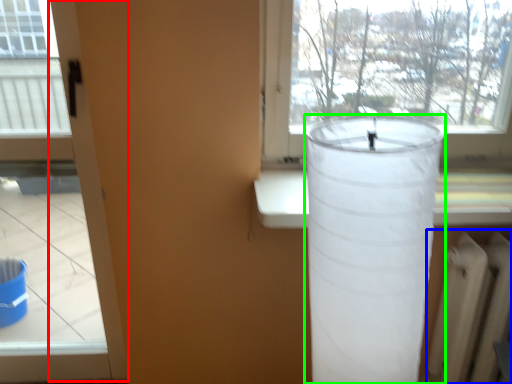
Question: Which object is positioned farthest from screen door (highlighted by a red box)? Select from radiator (highlighted by a blue box) and lamp (highlighted by a green box).

Choices:
 (A) radiator
 (B) lamp

Answer: (A)